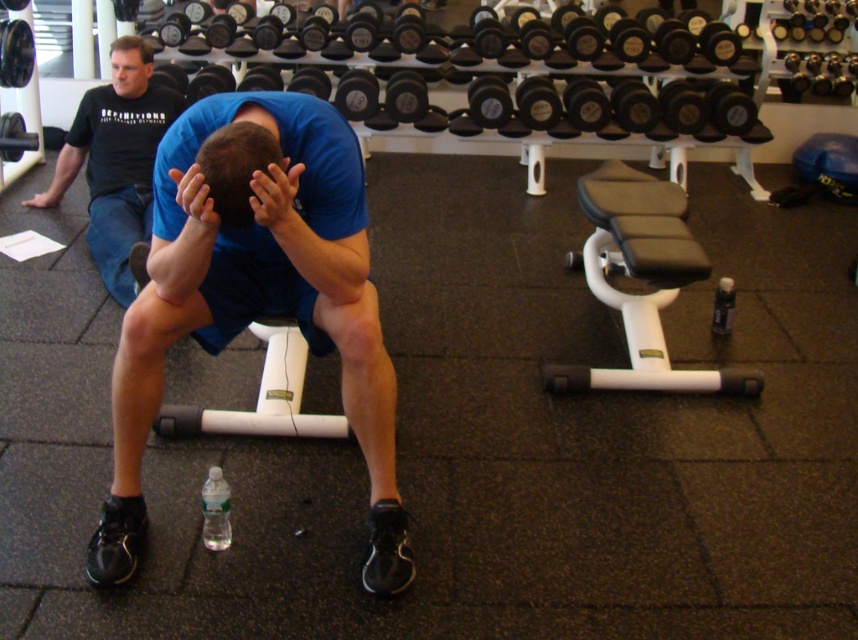
Is dark blue fabric head at center thinner than matte blue hands at center?

No.

Between dark blue fabric head at center and matte blue hands at center, which one is positioned higher?

dark blue fabric head at center is higher up.

Where is `dark blue fabric head at center`? The image size is (858, 640). dark blue fabric head at center is located at coordinates (236, 168).

Is matte blue hands at center below matte skin hand at center?

Incorrect, matte blue hands at center is not positioned below matte skin hand at center.

Is matte blue hands at center taller than matte skin hand at center?

Yes.

Between point (257, 188) and point (202, 211), which one is positioned in front?

Point (257, 188) is more forward.

Where is `matte blue hands at center`? The height and width of the screenshot is (640, 858). matte blue hands at center is located at coordinates (276, 196).

Can you confirm if black leather bench at center right is smaller than matte black hand at upper left?

No, black leather bench at center right is not smaller than matte black hand at upper left.

Which is in front, point (632, 307) or point (53, 188)?

Point (632, 307) is more forward.

The width and height of the screenshot is (858, 640). What are the coordinates of `black leather bench at center right` in the screenshot? It's located at (641, 280).